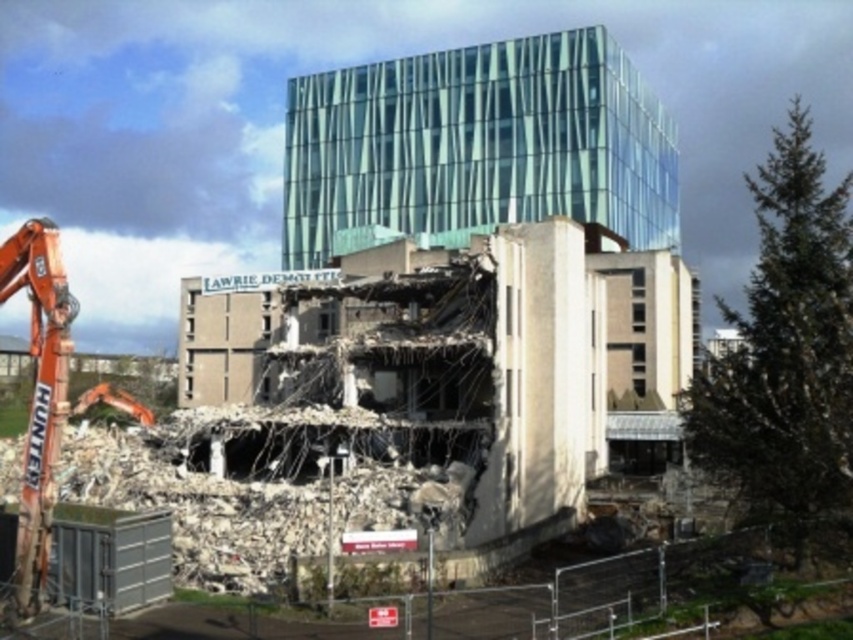
Question: Which object is positioned closest to the orange metallic excavator at left?

Choices:
 (A) transparent glass building at upper center
 (B) crumbled concrete debris at lower left

Answer: (B)

Question: Which is farther from the orange metallic excavator at left?

Choices:
 (A) crumbled concrete debris at lower left
 (B) transparent glass building at upper center

Answer: (B)

Question: Does transparent glass building at upper center have a smaller size compared to orange metallic excavator at left?

Choices:
 (A) yes
 (B) no

Answer: (B)

Question: Can you confirm if transparent glass building at upper center is bigger than orange metallic excavator at left?

Choices:
 (A) no
 (B) yes

Answer: (B)

Question: Among these points, which one is farthest from the camera?

Choices:
 (A) pos(457,472)
 (B) pos(50,504)
 (C) pos(445,129)

Answer: (C)

Question: Does crumbled concrete debris at lower left have a greater width compared to orange metallic excavator at left?

Choices:
 (A) yes
 (B) no

Answer: (A)